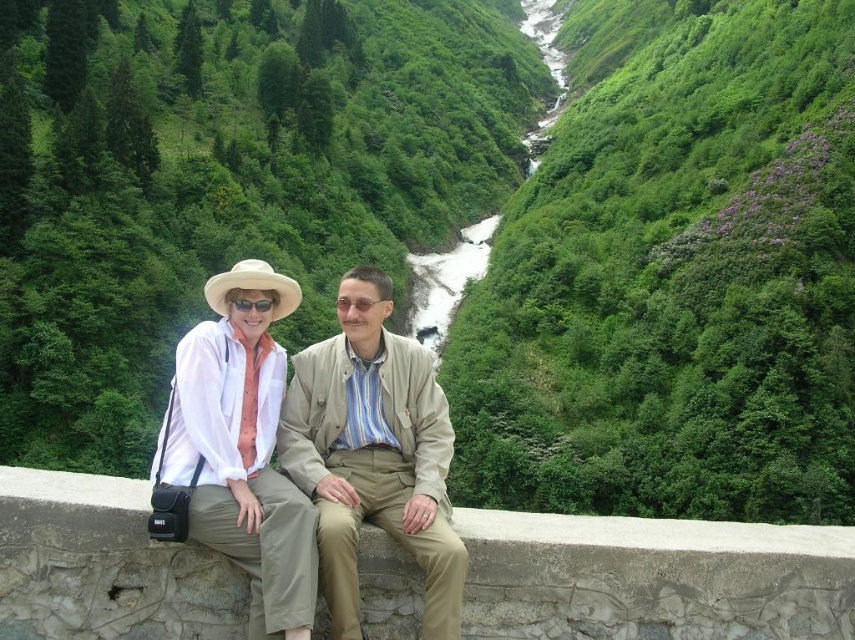
Question: Which object appears closest to the camera in this image?

Choices:
 (A) beige fabric jacket at center
 (B) white matte hat at upper left

Answer: (B)

Question: Which point is closer to the camera?

Choices:
 (A) white matte hat at upper left
 (B) beige fabric jacket at center

Answer: (A)

Question: Which point is farther to the camera?

Choices:
 (A) (334, 609)
 (B) (258, 468)

Answer: (B)

Question: Can you confirm if beige fabric jacket at center is smaller than white matte hat at upper left?

Choices:
 (A) no
 (B) yes

Answer: (B)

Question: Does beige fabric jacket at center have a larger size compared to white matte hat at upper left?

Choices:
 (A) no
 (B) yes

Answer: (A)

Question: Is beige fabric jacket at center bigger than white matte hat at upper left?

Choices:
 (A) yes
 (B) no

Answer: (B)